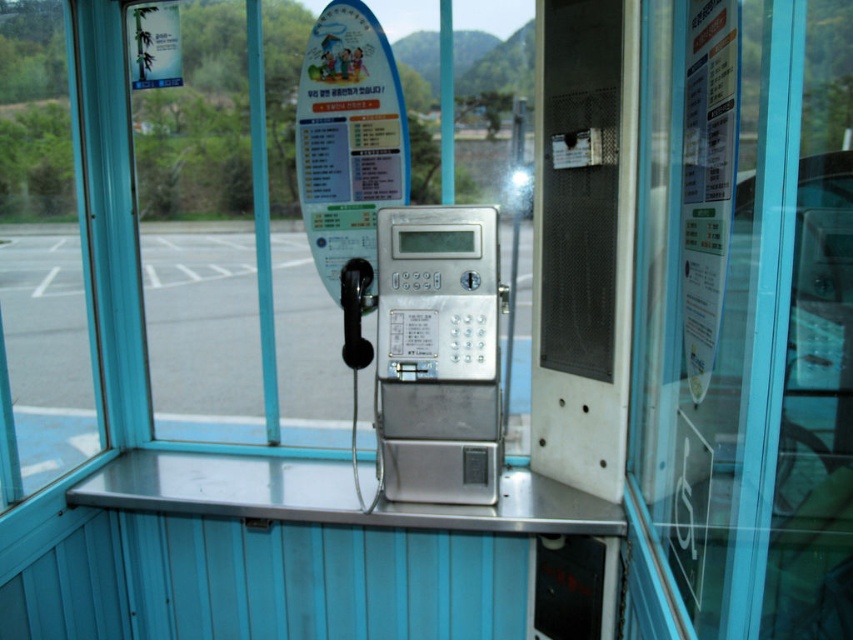
Which of these two, gray asphalt parking lot at center or sleek silver phone at center, stands taller?

Standing taller between the two is sleek silver phone at center.

Does gray asphalt parking lot at center lie behind sleek silver phone at center?

Yes.

Is point (73, 413) closer to camera compared to point (468, 212)?

No, it is not.

You are a GUI agent. You are given a task and a screenshot of the screen. Output one action in this format:
    pyautogui.click(x=<x>, y=<y>)
    Task: Click on the gray asphalt parking lot at center
    
    Given the screenshot: What is the action you would take?
    pyautogui.click(x=238, y=324)